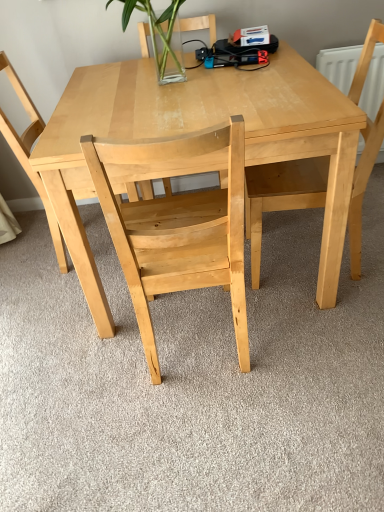
Find the location of a particular element. The image size is (384, 512). vacant space in front of natural wood chair at upper right, placed as the first chair when sorted from right to left is located at coordinates (329, 334).